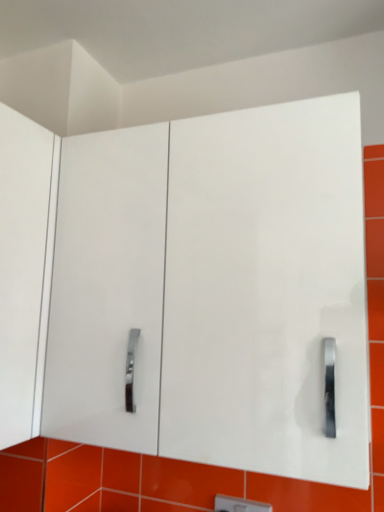
In order to face white glossy cabinet at center, should I rotate leftwards or rightwards?

Rotate right and turn 2.186 degrees.

At what (x,y) coordinates should I click in order to perform the action: click on white glossy cabinet at center. Please return your answer as a coordinate pair (x, y). Image resolution: width=384 pixels, height=512 pixels. Looking at the image, I should click on (266, 291).

This screenshot has height=512, width=384. Describe the element at coordinates (266, 291) in the screenshot. I see `white glossy cabinet at center` at that location.

Describe the element at coordinates (239, 505) in the screenshot. I see `white plastic light switch at center` at that location.

I want to click on white plastic light switch at center, so [x=239, y=505].

Find the location of a particular element. This screenshot has height=512, width=384. white glossy cabinet at center is located at coordinates (266, 291).

Which is more to the right, white plastic light switch at center or white glossy cabinet at center?

Positioned to the right is white plastic light switch at center.

Which object is closer to the camera taking this photo, white plastic light switch at center or white glossy cabinet at center?

white glossy cabinet at center is in front.

Which is farther, (246, 503) or (280, 220)?

The point (246, 503) is more distant.

From the image's perspective, which one is positioned lower, white plastic light switch at center or white glossy cabinet at center?

white plastic light switch at center appears lower in the image.

From a real-world perspective, is white plastic light switch at center beneath white glossy cabinet at center?

Indeed, from a real-world perspective, white plastic light switch at center is positioned beneath white glossy cabinet at center.

Which object is wider, white plastic light switch at center or white glossy cabinet at center?

white glossy cabinet at center.

In terms of height, does white plastic light switch at center look taller or shorter compared to white glossy cabinet at center?

Clearly, white plastic light switch at center is shorter compared to white glossy cabinet at center.

Considering the relative sizes of white plastic light switch at center and white glossy cabinet at center in the image provided, is white plastic light switch at center bigger than white glossy cabinet at center?

No.

Is white glossy cabinet at center surrounded by white plastic light switch at center?

No, white glossy cabinet at center is not inside white plastic light switch at center.

Are white plastic light switch at center and white glossy cabinet at center located far from each other?

white plastic light switch at center is near white glossy cabinet at center, not far away.

Does white plastic light switch at center turn towards white glossy cabinet at center?

No, white plastic light switch at center is not aimed at white glossy cabinet at center.

How much distance is there between white plastic light switch at center and white glossy cabinet at center?

white plastic light switch at center and white glossy cabinet at center are 24.40 inches apart from each other.

The height and width of the screenshot is (512, 384). I want to click on light switch on the right side of white glossy cabinet at center, so click(239, 505).

Which is more to the left, white glossy cabinet at center or white plastic light switch at center?

Positioned to the left is white glossy cabinet at center.

Which object is closer to the camera taking this photo, white glossy cabinet at center or white plastic light switch at center?

white glossy cabinet at center is closer to the camera.

Between point (192, 211) and point (258, 511), which one is positioned in front?

Positioned in front is point (192, 211).

From the image's perspective, is white glossy cabinet at center beneath white plastic light switch at center?

No, from the image's perspective, white glossy cabinet at center is not beneath white plastic light switch at center.

From a real-world perspective, is white glossy cabinet at center positioned over white plastic light switch at center based on gravity?

Correct, in the physical world, white glossy cabinet at center is higher than white plastic light switch at center.

Between white glossy cabinet at center and white plastic light switch at center, which one has smaller width?

white plastic light switch at center is thinner.

Does white glossy cabinet at center have a lesser height compared to white plastic light switch at center?

Incorrect, the height of white glossy cabinet at center does not fall short of that of white plastic light switch at center.

Considering the sizes of objects white glossy cabinet at center and white plastic light switch at center in the image provided, who is bigger, white glossy cabinet at center or white plastic light switch at center?

With larger size is white glossy cabinet at center.

Does white glossy cabinet at center contain white plastic light switch at center?

No, white glossy cabinet at center does not contain white plastic light switch at center.

Is white glossy cabinet at center not near white plastic light switch at center?

white glossy cabinet at center is actually quite close to white plastic light switch at center.

Is white glossy cabinet at center turned away from white plastic light switch at center?

No, white glossy cabinet at center is not facing away from white plastic light switch at center.

Locate an element on the screen. glass door lying in front of the white plastic light switch at center is located at coordinates (266, 291).

Where is `glass door above the white plastic light switch at center (from the image's perspective)`? glass door above the white plastic light switch at center (from the image's perspective) is located at coordinates (266, 291).

The height and width of the screenshot is (512, 384). In order to click on light switch on the right of white glossy cabinet at center in this screenshot , I will do `click(239, 505)`.